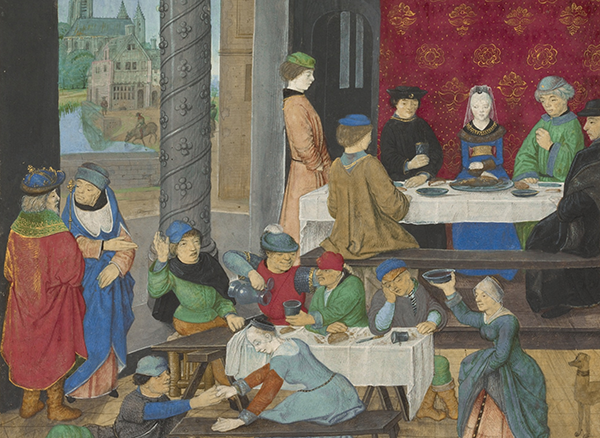
Find the location of a particular element. The image size is (600, 438). wooden floor is located at coordinates (552, 380).